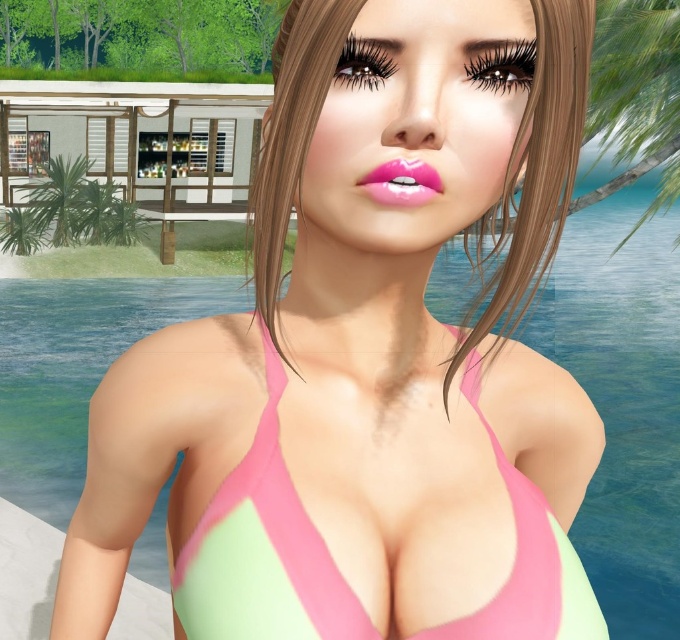
Which of these two, pink matte bikini top at center or glossy pink lips at center, stands shorter?

Standing shorter between the two is glossy pink lips at center.

Which is in front, point (286, 595) or point (384, 196)?

Point (384, 196) is more forward.

Who is more distant from viewer, (265, 468) or (381, 193)?

Positioned behind is point (265, 468).

Locate an element on the screen. The image size is (680, 640). pink matte bikini top at center is located at coordinates (262, 552).

The width and height of the screenshot is (680, 640). Identify the location of pink matte bikini top at center. (262, 552).

Does point (256, 595) come behind point (588, 67)?

That is False.

Measure the distance between point (306,595) and camera.

Point (306,595) is 23.83 inches away from camera.

You are a GUI agent. You are given a task and a screenshot of the screen. Output one action in this format:
    pyautogui.click(x=<x>, y=<y>)
    Task: Click on the pink matte bikini top at center
    This screenshot has height=640, width=680.
    Given the screenshot: What is the action you would take?
    point(262,552)

In the scene shown: Can you confirm if brownhair at center is positioned above glossy pink lips at center?

Indeed, brownhair at center is positioned over glossy pink lips at center.

Between point (564, 76) and point (405, 179), which one is positioned behind?

Point (564, 76)

Identify the location of brownhair at center. Image resolution: width=680 pixels, height=640 pixels. (532, 173).